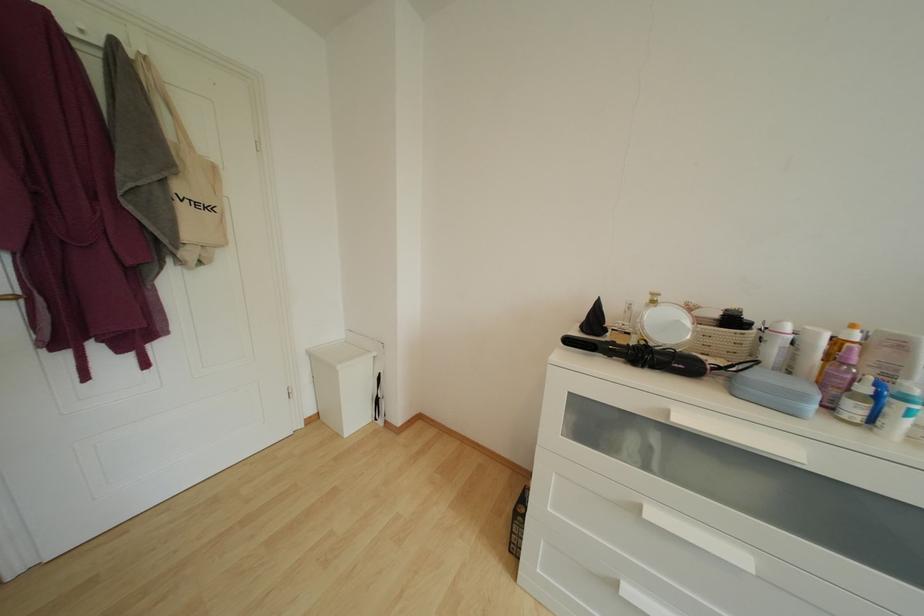
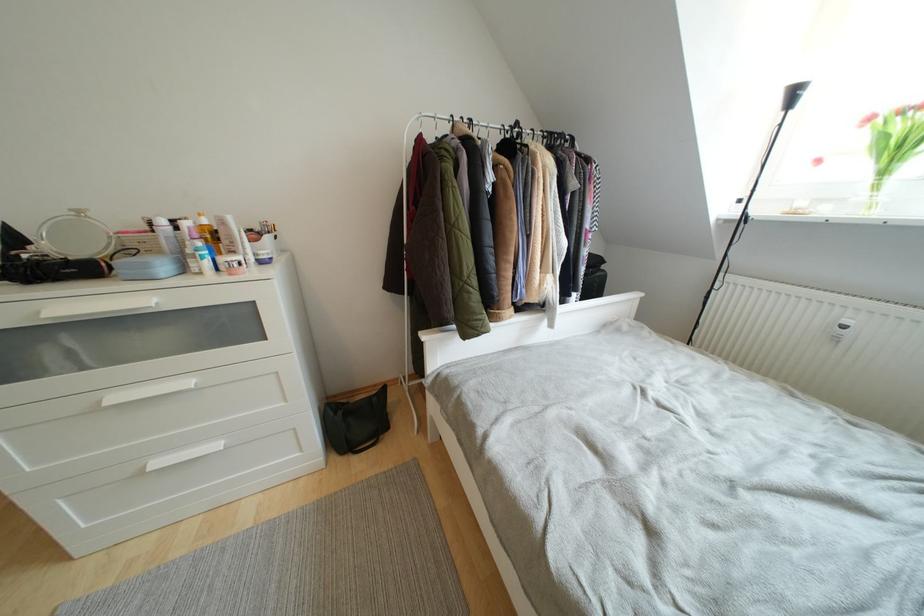
In the second image, find the point that corresponds to pixel 659 517 in the first image.

(120, 402)